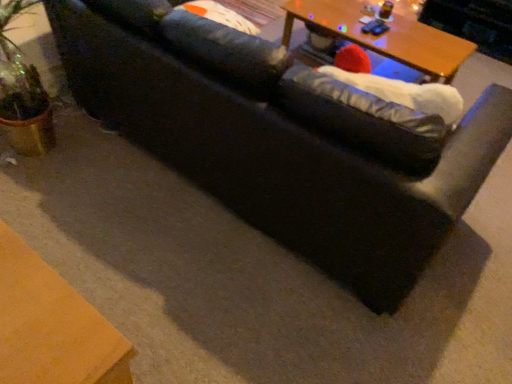
Question: Do you think wooden table at upper center is within white fabric bean bag at right, or outside of it?

Choices:
 (A) outside
 (B) inside

Answer: (A)

Question: From the image's perspective, is wooden table at upper center located above or below white fabric bean bag at right?

Choices:
 (A) below
 (B) above

Answer: (B)

Question: Is wooden table at upper center wider or thinner than white fabric bean bag at right?

Choices:
 (A) thin
 (B) wide

Answer: (B)

Question: In terms of size, does white fabric bean bag at right appear bigger or smaller than wooden table at upper center?

Choices:
 (A) big
 (B) small

Answer: (B)

Question: Is point (406, 152) closer or farther from the camera than point (289, 1)?

Choices:
 (A) farther
 (B) closer

Answer: (B)

Question: From the image's perspective, relative to wooden table at upper center, is white fabric bean bag at right above or below?

Choices:
 (A) below
 (B) above

Answer: (A)

Question: Visually, is white fabric bean bag at right positioned to the left or to the right of wooden table at upper center?

Choices:
 (A) right
 (B) left

Answer: (B)